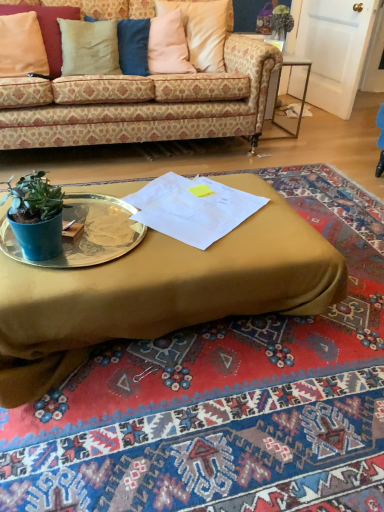
Where is `empty space that is ontop of matte gold coffee table at center (from a real-world perspective)`? empty space that is ontop of matte gold coffee table at center (from a real-world perspective) is located at coordinates (196, 209).